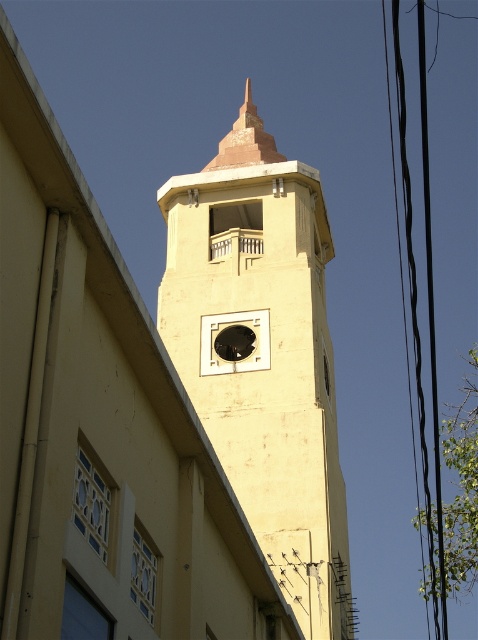
Question: Does yellow matte clock tower at center have a lesser width compared to black rubber power lines at right?

Choices:
 (A) no
 (B) yes

Answer: (B)

Question: Can you confirm if yellow matte clock tower at center is bigger than black rubber power lines at right?

Choices:
 (A) yes
 (B) no

Answer: (B)

Question: Is yellow matte clock tower at center further to camera compared to black rubber power lines at right?

Choices:
 (A) yes
 (B) no

Answer: (A)

Question: Which point is farther from the camera taking this photo?

Choices:
 (A) (275, 234)
 (B) (425, 228)

Answer: (B)

Question: Which object appears closest to the camera in this image?

Choices:
 (A) yellow matte clock tower at center
 (B) black rubber power lines at right

Answer: (B)